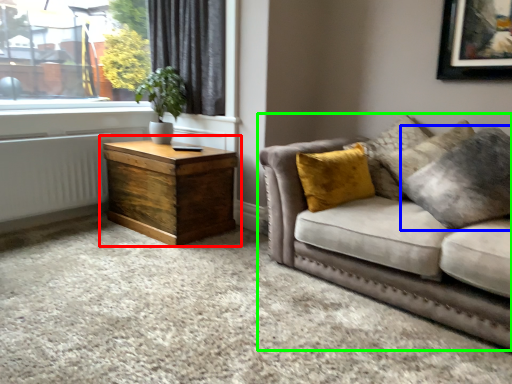
Question: Estimate the real-world distances between objects in this image. Which object is closer to nightstand (highlighted by a red box), pillow (highlighted by a blue box) or studio couch (highlighted by a green box)?

Choices:
 (A) pillow
 (B) studio couch

Answer: (B)